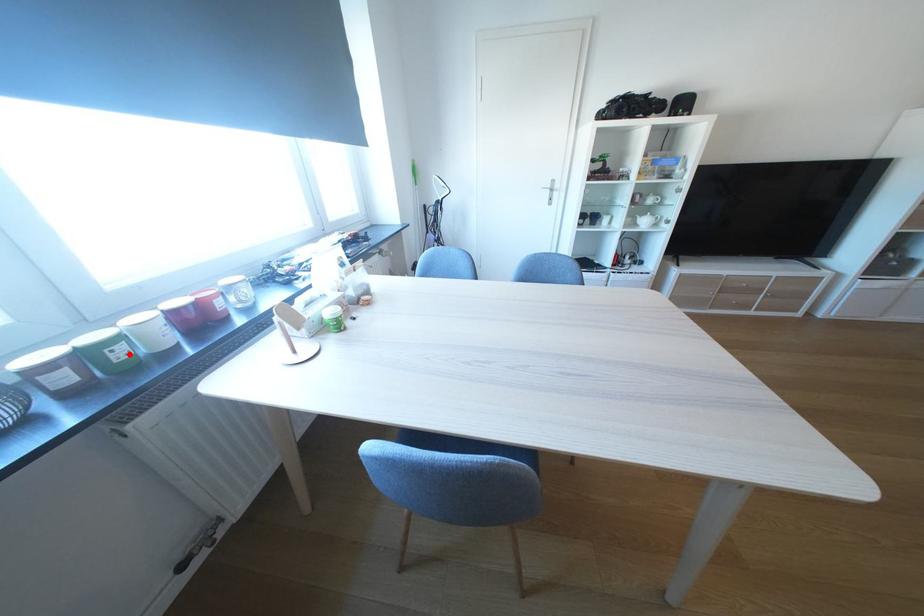
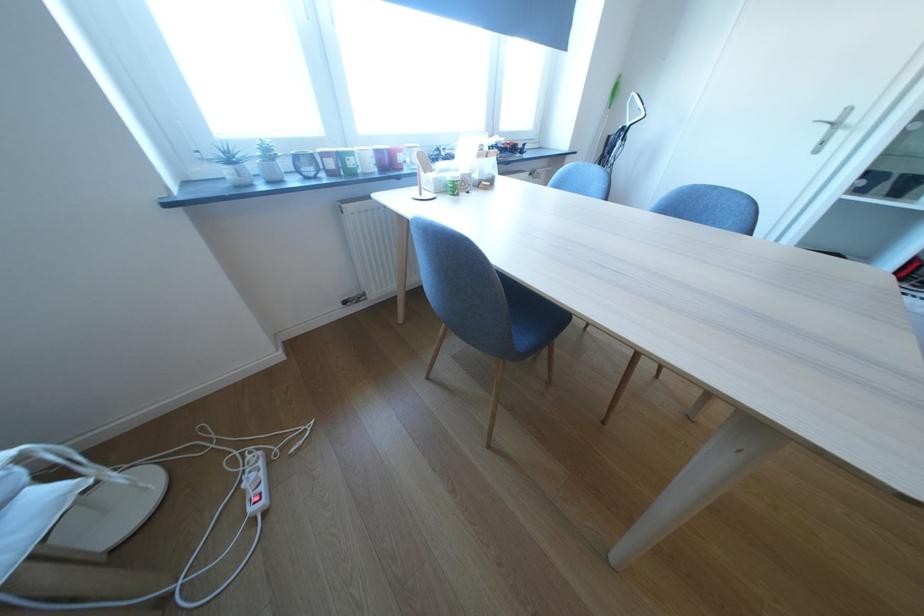
Find the pixel in the second image that matches the highlighted location in the first image.

(361, 164)